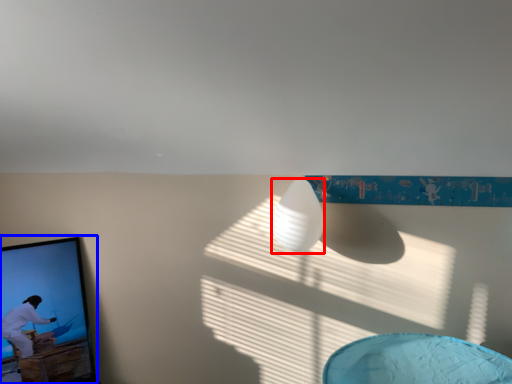
Question: Which object appears closest to the camera in this image, lamp (highlighted by a red box) or picture frame (highlighted by a blue box)?

Choices:
 (A) lamp
 (B) picture frame

Answer: (A)